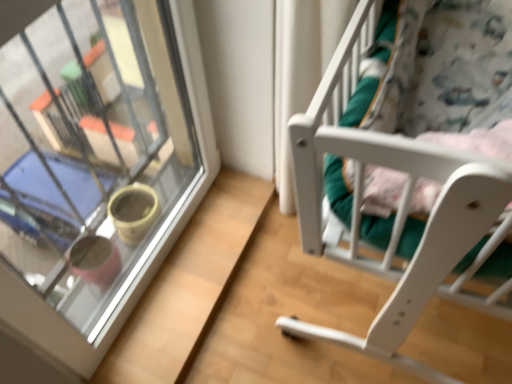
What is the approximate height of white wooden crib at right?

The height of white wooden crib at right is 22.78 centimeters.

Locate an element on the screen. The height and width of the screenshot is (384, 512). white wooden crib at right is located at coordinates (397, 212).

What do you see at coordinates (397, 212) in the screenshot? I see `white wooden crib at right` at bounding box center [397, 212].

Locate an element on the screen. The image size is (512, 384). white wooden crib at right is located at coordinates (397, 212).